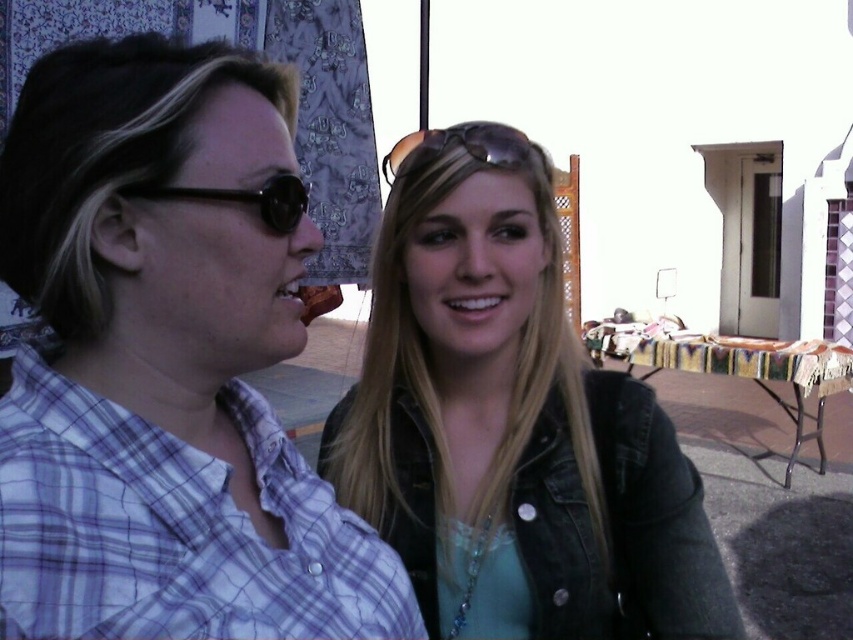
Question: Among these objects, which one is nearest to the camera?

Choices:
 (A) sunglasses at left
 (B) denim jacket at center
 (C) plaid shirt at left
 (D) sunglasses at center

Answer: (C)

Question: Does plaid shirt at left appear over denim jacket at center?

Choices:
 (A) no
 (B) yes

Answer: (B)

Question: Which of these objects is positioned farthest from the plaid shirt at left?

Choices:
 (A) sunglasses at left
 (B) denim jacket at center

Answer: (B)

Question: Can you confirm if plaid shirt at left is positioned to the right of sunglasses at left?

Choices:
 (A) no
 (B) yes

Answer: (A)

Question: Can you confirm if denim jacket at center is thinner than sunglasses at left?

Choices:
 (A) yes
 (B) no

Answer: (B)

Question: Among these objects, which one is nearest to the camera?

Choices:
 (A) sunglasses at left
 (B) denim jacket at center
 (C) plaid shirt at left
 (D) sunglasses at center

Answer: (C)